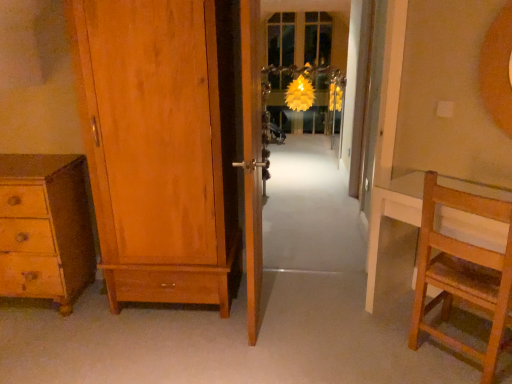
Locate an element on the screen. vacant area that lies between wooden door at center, acting as the second door starting from the left, and matte wood wardrobe at left, which is the first door in left-to-right order is located at coordinates (189, 332).